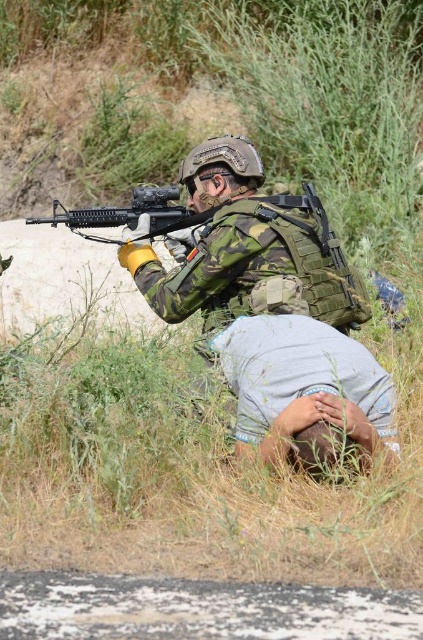
Is gray cotton squat at lower center wider than matte black rifle at center?

No.

Between point (255, 449) and point (62, 216), which one is positioned in front?

Point (255, 449) is more forward.

You are a GUI agent. You are given a task and a screenshot of the screen. Output one action in this format:
    pyautogui.click(x=<x>, y=<y>)
    Task: Click on the gray cotton squat at lower center
    The width and height of the screenshot is (423, 640).
    Given the screenshot: What is the action you would take?
    pyautogui.click(x=304, y=388)

Where is `camo fabric uniform at center`? camo fabric uniform at center is located at coordinates (244, 252).

Which is below, camo fabric uniform at center or matte black rifle at center?

camo fabric uniform at center is lower down.

Which is in front, point (291, 401) or point (173, 221)?

Positioned in front is point (291, 401).

Find the location of a particular element. The width and height of the screenshot is (423, 640). camo fabric uniform at center is located at coordinates (244, 252).

Which is in front, point (216, 184) or point (367, 388)?

Point (367, 388) is more forward.

Can you confirm if camo fabric uniform at center is positioned to the left of gray cotton squat at lower center?

Correct, you'll find camo fabric uniform at center to the left of gray cotton squat at lower center.

You are a GUI agent. You are given a task and a screenshot of the screen. Output one action in this format:
    pyautogui.click(x=<x>, y=<y>)
    Task: Click on the camo fabric uniform at center
    The height and width of the screenshot is (640, 423).
    Given the screenshot: What is the action you would take?
    pyautogui.click(x=244, y=252)